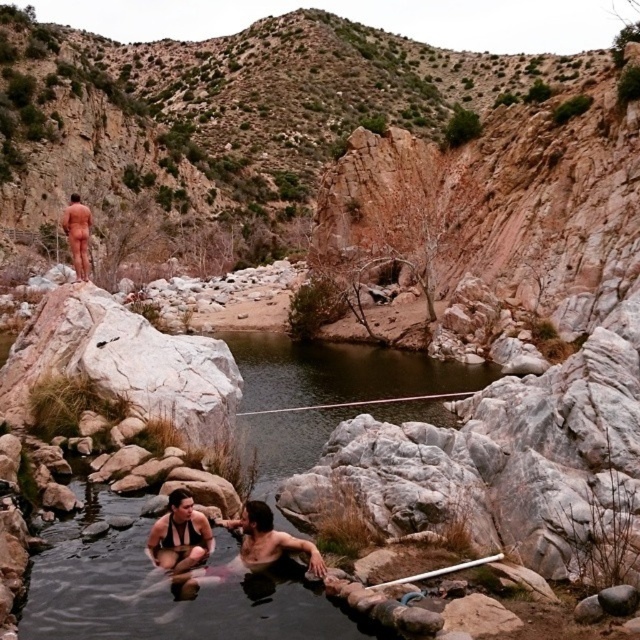
You are a photographer positioned at the edge of the pool. You want to take a photo that includes both the matte black swimsuit at center and the nude skin at upper left. Which object should you focus on first to ensure both are in sharp focus?

You should focus on the matte black swimsuit at center first because it is closer to the viewer than the nude skin at upper left. By focusing on the closer object, the depth of field may help keep the farther object in focus as well.

You are a photographer aiming to capture the matte black swimsuit at center and the nude skin at upper left in a single frame. Based on their positions, which object is located to the right of the other?

The matte black swimsuit at center is positioned on the right side of nude skin at upper left.